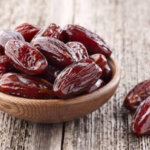
Identify the location of prunes in bowl. (38, 56), (80, 72).